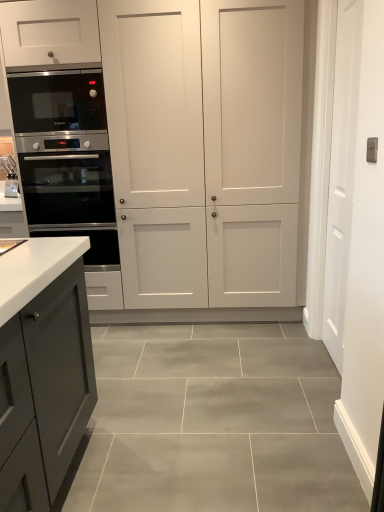
Question: Is black stainless steel microwave at left further to the viewer compared to white smooth door at right?

Choices:
 (A) yes
 (B) no

Answer: (A)

Question: Considering the relative positions of black stainless steel microwave at left and white smooth door at right in the image provided, is black stainless steel microwave at left to the right of white smooth door at right from the viewer's perspective?

Choices:
 (A) no
 (B) yes

Answer: (A)

Question: From the image's perspective, is black stainless steel microwave at left located above white smooth door at right?

Choices:
 (A) no
 (B) yes

Answer: (B)

Question: From the image's perspective, does black stainless steel microwave at left appear lower than white smooth door at right?

Choices:
 (A) yes
 (B) no

Answer: (B)

Question: Can you confirm if black stainless steel microwave at left is shorter than white smooth door at right?

Choices:
 (A) no
 (B) yes

Answer: (B)

Question: Does black stainless steel microwave at left have a greater width compared to white smooth door at right?

Choices:
 (A) yes
 (B) no

Answer: (A)

Question: Is stainless steel oven at left far away from white matte cabinet at center?

Choices:
 (A) yes
 (B) no

Answer: (B)

Question: From the image's perspective, would you say stainless steel oven at left is shown under white matte cabinet at center?

Choices:
 (A) no
 (B) yes

Answer: (B)

Question: Is stainless steel oven at left looking in the opposite direction of white matte cabinet at center?

Choices:
 (A) yes
 (B) no

Answer: (A)

Question: From the image's perspective, is stainless steel oven at left on white matte cabinet at center?

Choices:
 (A) yes
 (B) no

Answer: (B)

Question: Does stainless steel oven at left appear on the left side of white matte cabinet at center?

Choices:
 (A) yes
 (B) no

Answer: (A)

Question: Can you confirm if stainless steel oven at left is positioned to the right of white matte cabinet at center?

Choices:
 (A) yes
 (B) no

Answer: (B)

Question: From the image's perspective, is white matte cabinet at center under white glossy sink at left?

Choices:
 (A) yes
 (B) no

Answer: (B)